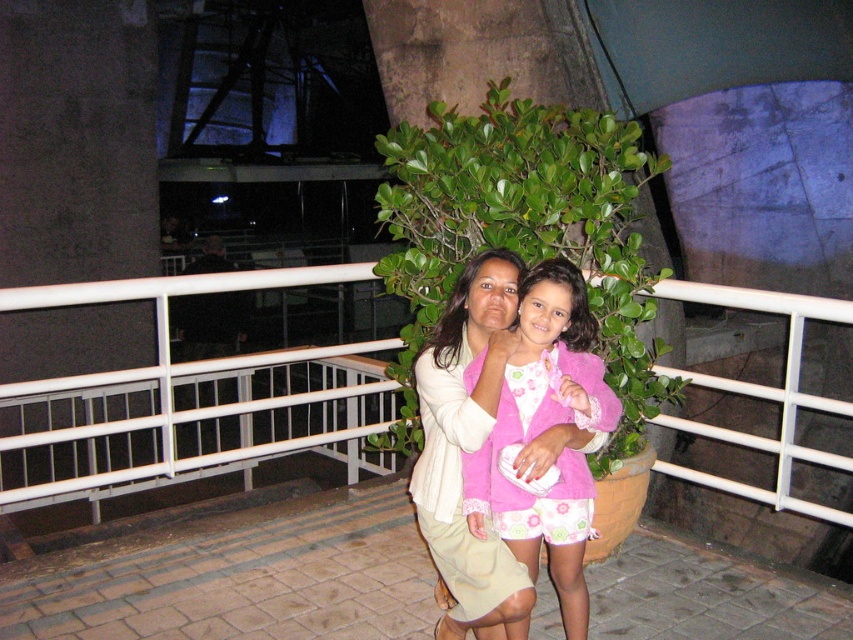
You are a photographer trying to capture a photo of the white metal balustrade at center and the pink fuzzy jacket at center. Which object is positioned lower in the image?

The white metal balustrade at center is located below the pink fuzzy jacket at center, so it is positioned lower in the image.

You are a photographer trying to capture a group photo of the two people in the image. The camera you are using has a limited frame width. Given that the pink fuzzy jacket at center is wider than the light beige fabric jacket at center, which person should you position closer to the center of the frame to ensure both fit comfortably?

You should position the person wearing the pink fuzzy jacket at center closer to the center of the frame since it has a larger width compared to the light beige fabric jacket at center. This will help balance the composition and ensure both individuals fit within the camera frame.

You are a photographer trying to capture a photo of the white metal balustrade at center and the light beige fabric jacket at center. Which object is shorter in height?

The white metal balustrade at center is not as tall as the light beige fabric jacket at center, so the white metal balustrade at center is shorter in height.